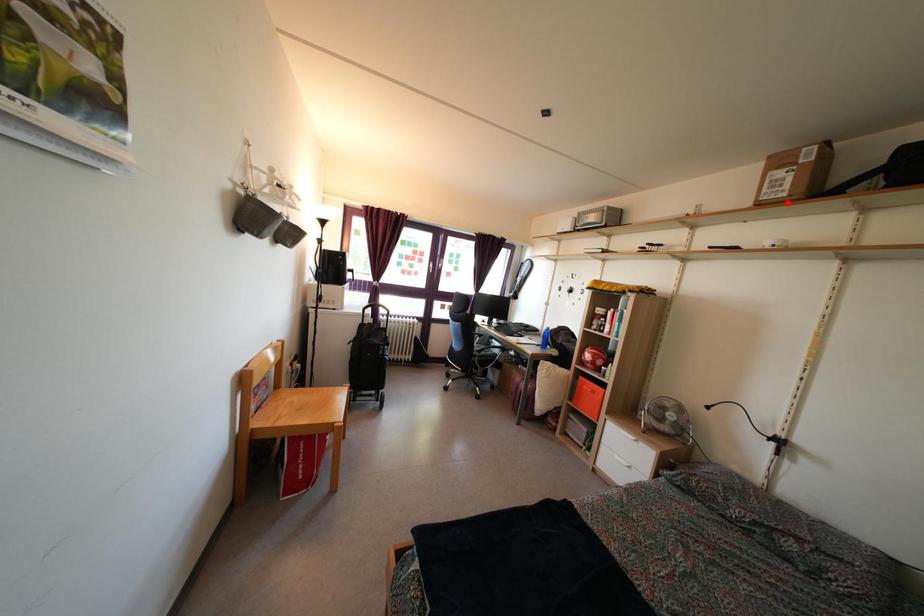
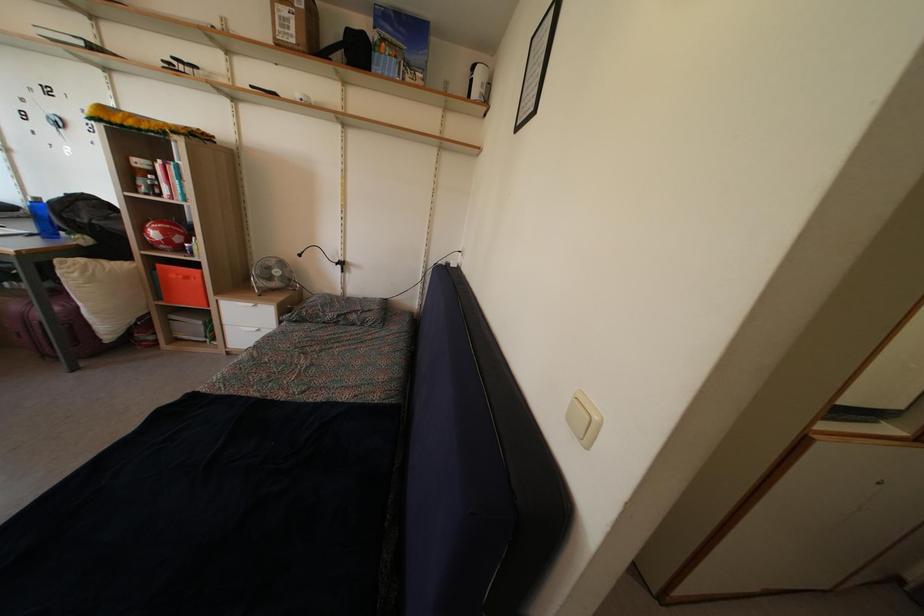
In the second image, find the point that corresponds to the highlighted location in the first image.

(296, 50)